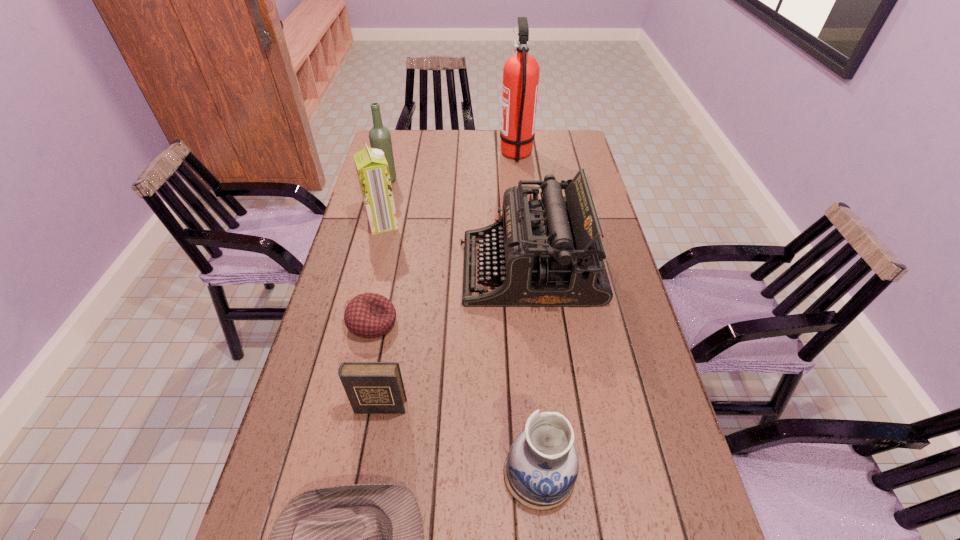
Where is `vacant space located on the handle side of the tallest object`? This screenshot has height=540, width=960. vacant space located on the handle side of the tallest object is located at coordinates (449, 154).

The width and height of the screenshot is (960, 540). I want to click on vacant region located 0.270m on the handle side of the tallest object, so click(x=432, y=154).

The image size is (960, 540). What are the coordinates of `free space located on the right of the wine bottle` in the screenshot? It's located at (497, 180).

This screenshot has height=540, width=960. I want to click on vacant space located 0.230m on the right of the soya milk, so click(x=469, y=224).

The image size is (960, 540). I want to click on free space located on the keyboard of the typewriter, so click(437, 269).

Where is `vacant space located on the keyboard of the typewriter`? vacant space located on the keyboard of the typewriter is located at coordinates (399, 269).

This screenshot has height=540, width=960. I want to click on free space located 0.120m on the keyboard of the typewriter, so click(420, 269).

Where is `free region located on the back of the pottery`? free region located on the back of the pottery is located at coordinates (524, 304).

In order to click on vacant space situated 0.180m on the front cover of the diary in this screenshot , I will do `click(364, 500)`.

Locate an element on the screen. The image size is (960, 540). free space located 0.070m on the left of the beanbag is located at coordinates point(322,323).